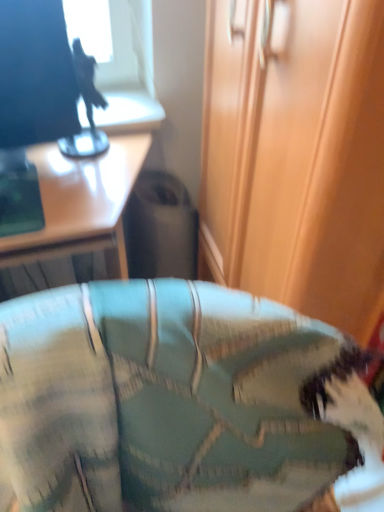
Describe the element at coordinates (167, 400) in the screenshot. The width and height of the screenshot is (384, 512). I see `green fabric chair at center` at that location.

The image size is (384, 512). I want to click on green fabric chair at center, so click(167, 400).

Locate an element on the screen. Image resolution: width=384 pixels, height=512 pixels. green fabric chair at center is located at coordinates (167, 400).